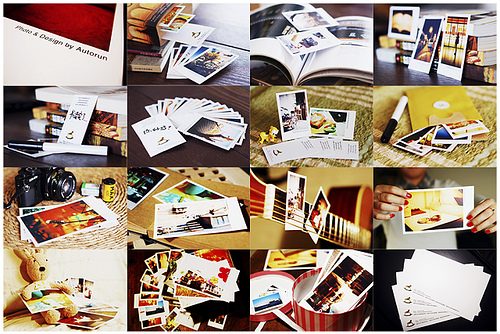
Find the location of a particular element. This screenshot has height=334, width=500. table is located at coordinates (402, 79).